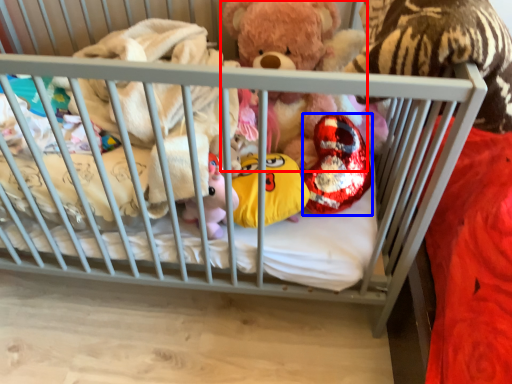
Question: Which object appears closest to the camera in this image, teddy bear (highlighted by a red box) or toy (highlighted by a blue box)?

Choices:
 (A) teddy bear
 (B) toy

Answer: (A)